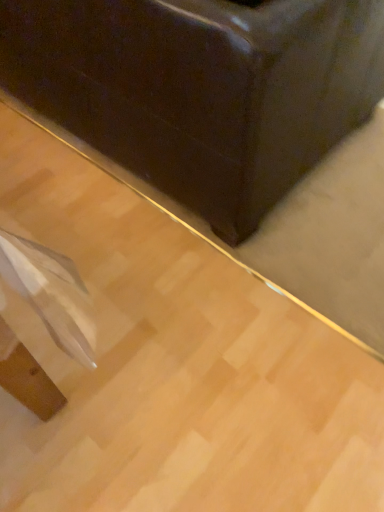
Describe the element at coordinates (200, 90) in the screenshot. The image size is (384, 512). I see `glossy dark brown couch at upper left` at that location.

Locate an element on the screen. The width and height of the screenshot is (384, 512). glossy dark brown couch at upper left is located at coordinates (200, 90).

The height and width of the screenshot is (512, 384). In order to click on glossy dark brown couch at upper left in this screenshot , I will do `click(200, 90)`.